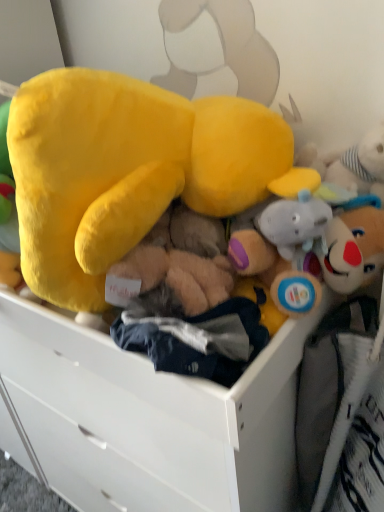
Question: Is fluffy yellow plush at center next to white matte drawer at center?

Choices:
 (A) no
 (B) yes

Answer: (A)

Question: Considering the relative positions of fluffy yellow plush at center and white matte drawer at center in the image provided, is fluffy yellow plush at center to the right of white matte drawer at center from the viewer's perspective?

Choices:
 (A) yes
 (B) no

Answer: (B)

Question: Could you tell me if fluffy yellow plush at center is facing white matte drawer at center?

Choices:
 (A) no
 (B) yes

Answer: (A)

Question: From a real-world perspective, does fluffy yellow plush at center stand above white matte drawer at center?

Choices:
 (A) yes
 (B) no

Answer: (A)

Question: Is there a large distance between fluffy yellow plush at center and white matte drawer at center?

Choices:
 (A) no
 (B) yes

Answer: (A)

Question: Does fluffy yellow plush at center come behind white matte drawer at center?

Choices:
 (A) yes
 (B) no

Answer: (B)

Question: Is white matte drawer at center shorter than fluffy yellow plush at center?

Choices:
 (A) yes
 (B) no

Answer: (B)

Question: From the image's perspective, is white matte drawer at center above fluffy yellow plush at center?

Choices:
 (A) yes
 (B) no

Answer: (B)

Question: From the image's perspective, is white matte drawer at center beneath fluffy yellow plush at center?

Choices:
 (A) yes
 (B) no

Answer: (A)

Question: Are white matte drawer at center and fluffy yellow plush at center far apart?

Choices:
 (A) yes
 (B) no

Answer: (B)

Question: Is white matte drawer at center wider than fluffy yellow plush at center?

Choices:
 (A) no
 (B) yes

Answer: (B)

Question: From a real-world perspective, is white matte drawer at center under fluffy yellow plush at center?

Choices:
 (A) yes
 (B) no

Answer: (A)

Question: Considering the positions of fluffy yellow plush at center and white matte drawer at center in the image, is fluffy yellow plush at center wider or thinner than white matte drawer at center?

Choices:
 (A) wide
 (B) thin

Answer: (B)